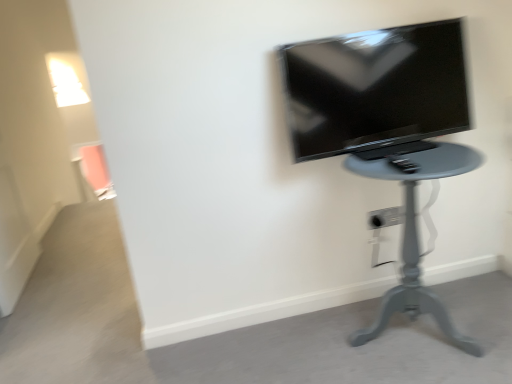
Find the location of a particular element. This screenshot has height=384, width=512. free region under matte gray table at center (from a real-world perspective) is located at coordinates (407, 332).